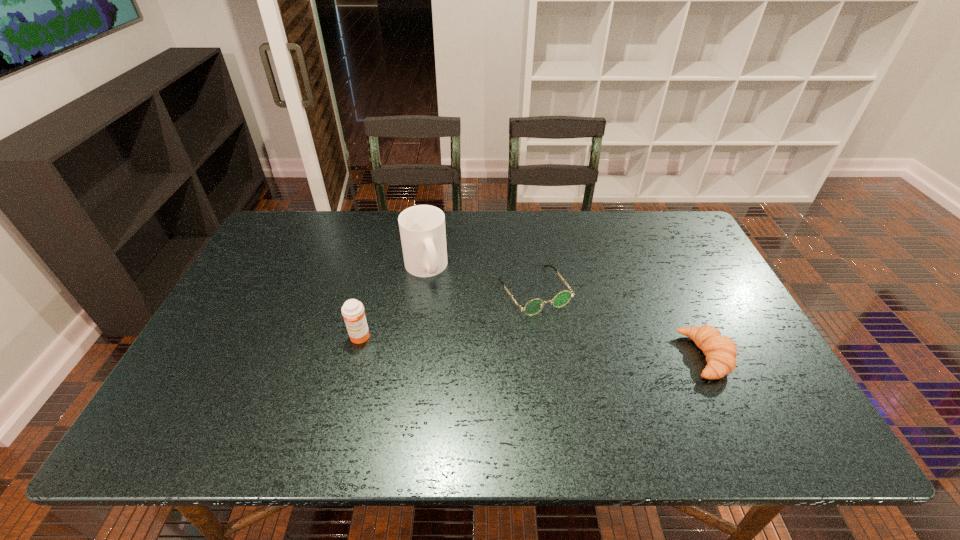
Where is `vacant space on the desktop that is between the medicine and the rightmost object and is positioned on the handle side of the second object from left to right`? Image resolution: width=960 pixels, height=540 pixels. vacant space on the desktop that is between the medicine and the rightmost object and is positioned on the handle side of the second object from left to right is located at coordinates pyautogui.click(x=481, y=344).

Find the location of `vacant space on the desktop that is between the medicine and the crescent roll and is positioned on the lenses of the third object from left to right`. vacant space on the desktop that is between the medicine and the crescent roll and is positioned on the lenses of the third object from left to right is located at coordinates (575, 349).